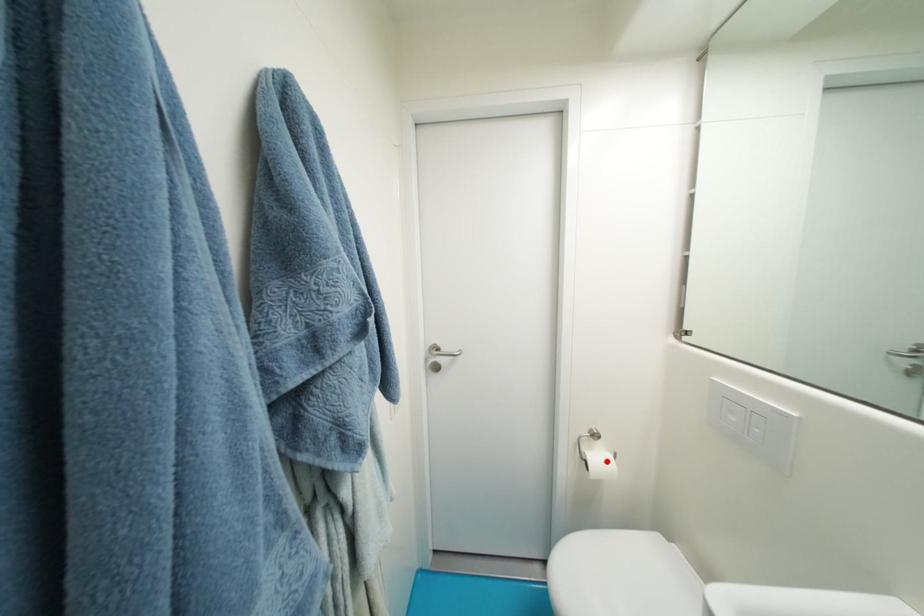
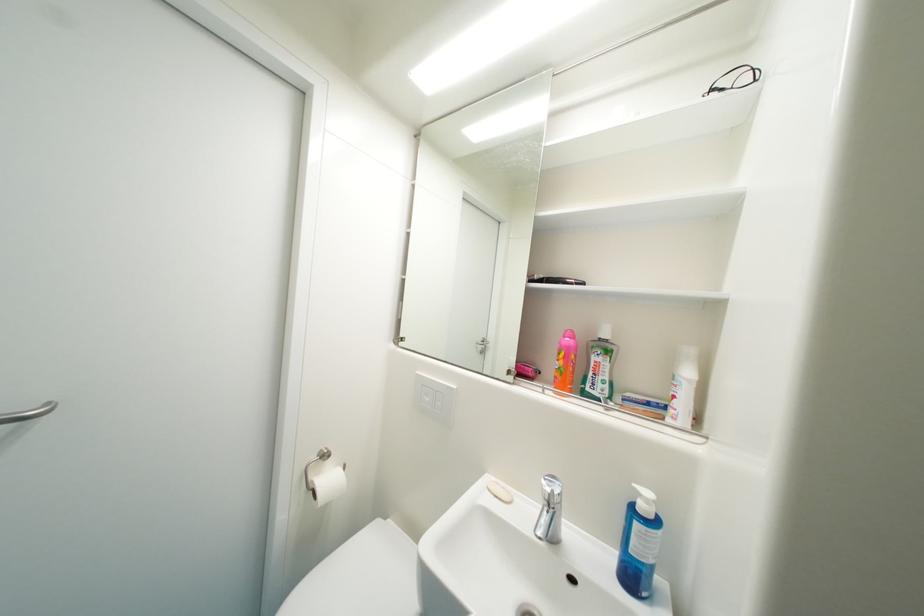
Where in the second image is the point corresponding to the highlighted location from the first image?

(337, 482)